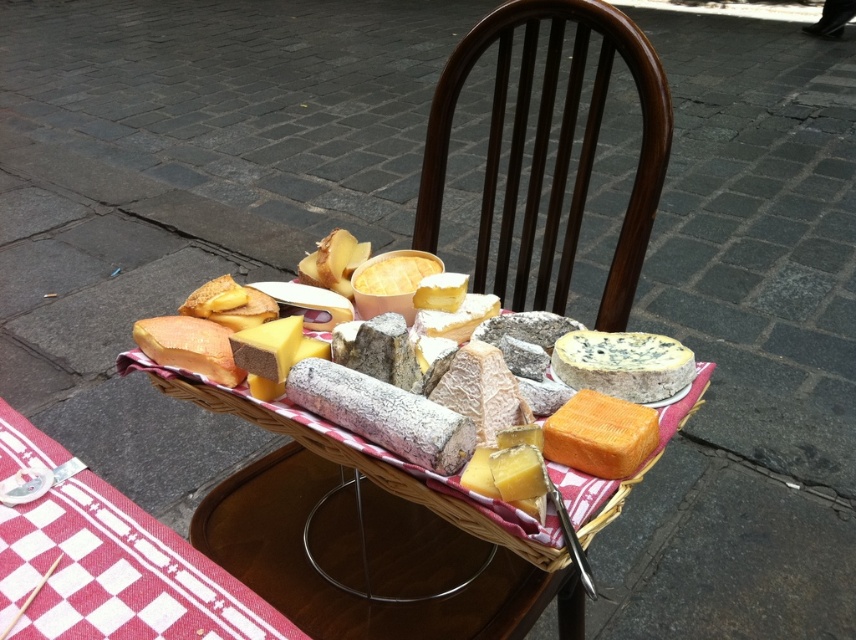
You are a guest at an outdoor event and want to sit down at the table where the orange hard cheese at center is displayed. There is a dark brown wood chair at center nearby. Can you sit on the chair without moving the cheese platter?

The orange hard cheese at center is behind the dark brown wood chair at center, so the chair is in front of the cheese platter. Therefore, you can sit on the dark brown wood chair at center without moving the cheese platter.